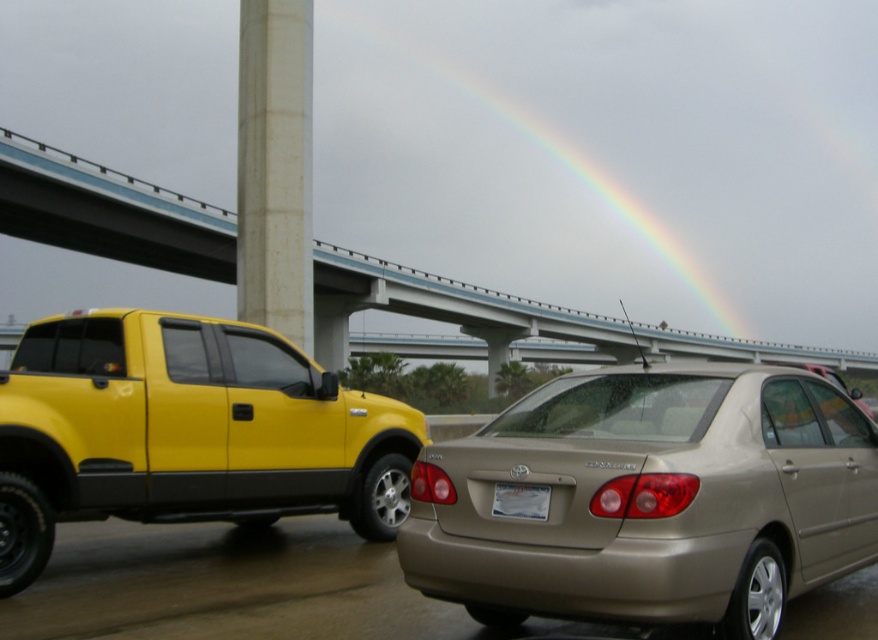
You are a delivery driver who needs to park your vehicle under the bridge. You see the concrete textured column at center and the white plastic license plate at center. Which object is closer to the left side of the parking area?

The concrete textured column at center is closer to the left side of the parking area because it is positioned to the left of the white plastic license plate at center.

Looking at this image, you are a delivery driver who needs to park your truck in a parking lot. You see the shiny yellow truck at left and the white plastic license plate at center in the parking area. Which object is wider?

The shiny yellow truck at left is wider than the white plastic license plate at center, as its width surpasses the license plate.

You are a photographer trying to capture the rainbow in the background while ensuring both the concrete textured column at center and the white plastic license plate at center are visible in the frame. Since the column is wider, will you need to adjust your camera angle to include both objects without cropping either?

The concrete textured column at center is wider than the white plastic license plate at center. To include both in the frame without cropping, you may need to adjust your camera angle or zoom out slightly to accommodate the column.